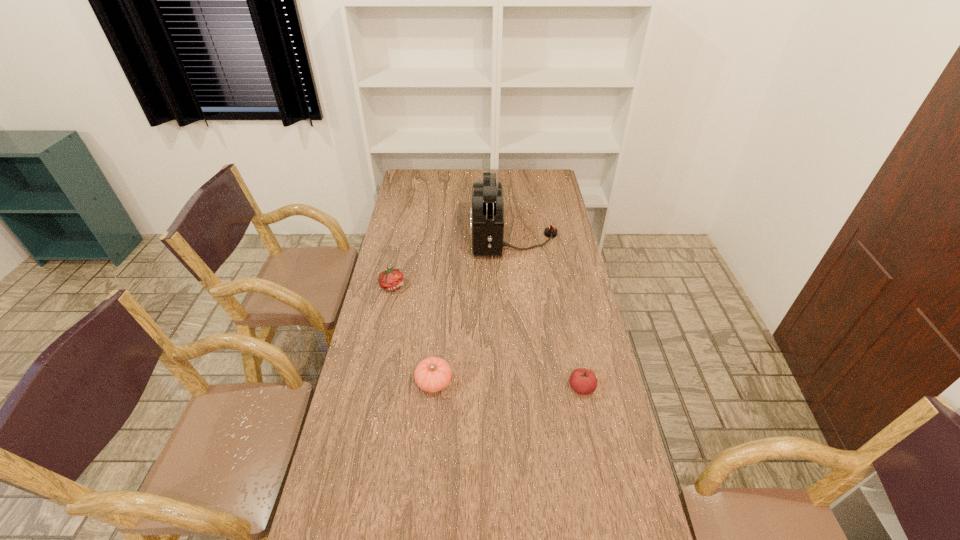
This screenshot has width=960, height=540. What are the coordinates of `free spot located 0.240m on the front of the rightmost tomato` in the screenshot? It's located at (599, 477).

This screenshot has height=540, width=960. I want to click on free space located 0.260m on the right of the farthest tomato, so click(x=470, y=286).

Where is `object that is at the left edge`? object that is at the left edge is located at coordinates (391, 279).

This screenshot has width=960, height=540. I want to click on radio receiver present at the right edge, so click(487, 212).

This screenshot has height=540, width=960. What are the coordinates of `tomato positioned at the right edge` in the screenshot? It's located at (583, 381).

This screenshot has width=960, height=540. In the image, there is a desktop. Find the location of `vacant space at the far edge`. vacant space at the far edge is located at coordinates (467, 170).

At what (x,y) coordinates should I click in order to perform the action: click on vacant space at the left edge of the desktop. Please return your answer as a coordinate pair (x, y). This screenshot has width=960, height=540. Looking at the image, I should click on (382, 321).

The width and height of the screenshot is (960, 540). What are the coordinates of `vacant space at the right edge of the desktop` in the screenshot? It's located at (553, 294).

Locate an element on the screen. The image size is (960, 540). vacant space at the far left corner of the desktop is located at coordinates (429, 172).

Locate an element on the screen. free area in between the leftmost object and the rightmost tomato is located at coordinates (487, 336).